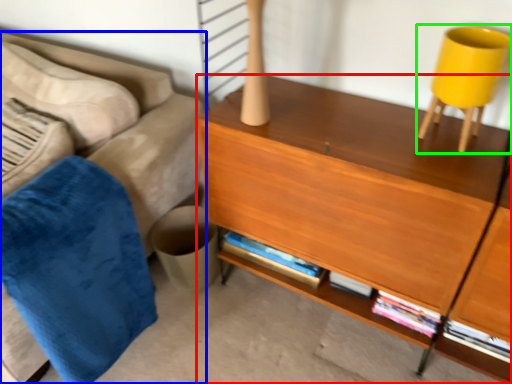
Question: Which object is the farthest from desk (highlighted by a red box)? Choose among these: studio couch (highlighted by a blue box) or swivel chair (highlighted by a green box).

Choices:
 (A) studio couch
 (B) swivel chair

Answer: (A)